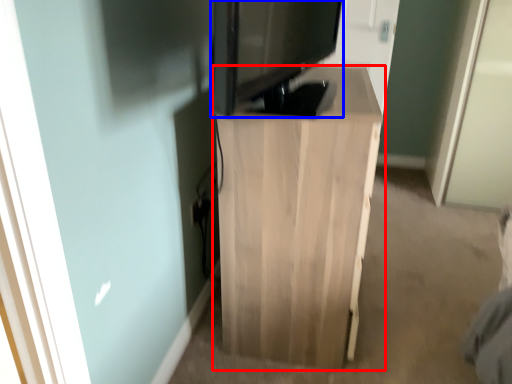
Question: Which of the following is the farthest to the observer, furniture (highlighted by a red box) or electronic (highlighted by a blue box)?

Choices:
 (A) furniture
 (B) electronic

Answer: (A)